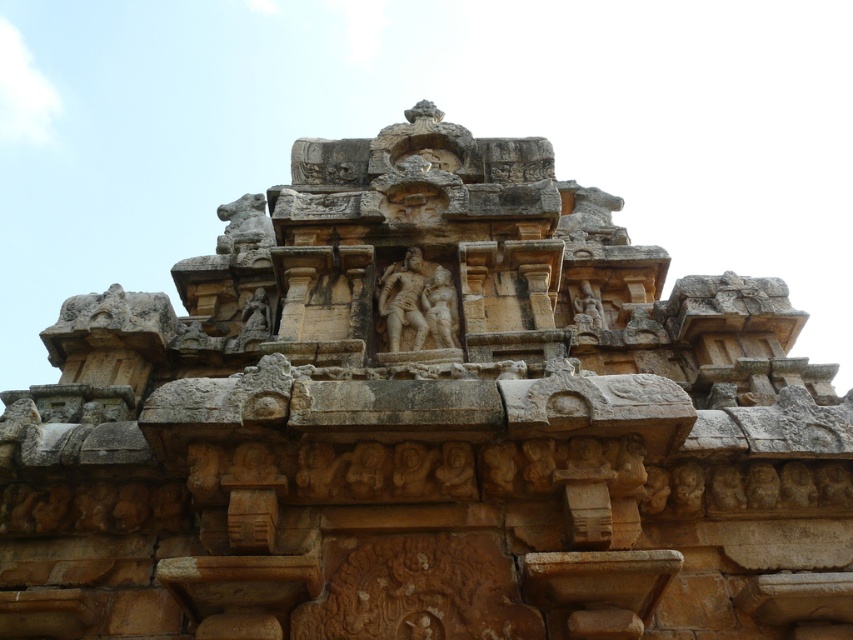
You are an architect examining the historical stone structure. You need to determine the spatial relationship between the stone carved sculpture at center and the carved stone statue at upper right. Which one is taller?

The stone carved sculpture at center is taller than the carved stone statue at upper right.

You are an archaeologist examining the historical stone structure. You notice the stone carved sculpture at center and the carved stone statue at upper right. Which of these two objects is positioned to the left of the other?

The stone carved sculpture at center is to the left of carved stone statue at upper right.

You are an archaeologist examining the ancient stone structure. You notice two points marked on the structure. The first point is at coordinate point (397,332) and the second is at point (582,291). Which of these points is closer to your viewpoint as you observe the structure?

Point (397,332) is closer to the camera than point (582,291), so the first point is closer to your viewpoint.